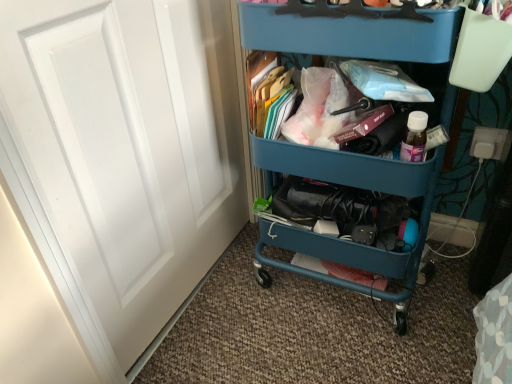
This screenshot has height=384, width=512. I want to click on blue plastic cart at upper center, so point(426,87).

What is the approximate height of white matte door at left?

white matte door at left is 31.99 inches in height.

At what (x,y) coordinates should I click in order to perform the action: click on teal plastic cart at center. Please return your answer as a coordinate pair (x, y). The width and height of the screenshot is (512, 384). Looking at the image, I should click on (348, 185).

Consider the image. Is white matte door at left a part of teal plastic cart at center?

Actually, white matte door at left is outside teal plastic cart at center.

Is white matte door at left at the back of teal plastic cart at center?

teal plastic cart at center is not turned away from white matte door at left.

Does teal plastic cart at center lie behind white matte door at left?

Yes, teal plastic cart at center is further from the viewer.

Which is farther from the camera, (269,152) or (198,97)?

The point (198,97) is farther.

In the scene shown: Is blue plastic cart at upper center aimed at white matte door at left?

No, blue plastic cart at upper center is not aimed at white matte door at left.

Is blue plastic cart at upper center to the right of white matte door at left from the viewer's perspective?

Correct, you'll find blue plastic cart at upper center to the right of white matte door at left.

Considering the relative sizes of blue plastic cart at upper center and white matte door at left in the image provided, is blue plastic cart at upper center wider than white matte door at left?

Yes, blue plastic cart at upper center is wider than white matte door at left.

Is there a large distance between blue plastic cart at upper center and white matte door at left?

They are positioned close to each other.

What's the angular difference between teal plastic cart at center and blue plastic cart at upper center's facing directions?

They differ by 0.00026 degrees in their facing directions.

Find the location of a particular element. The width and height of the screenshot is (512, 384). furniture in front of the blue plastic cart at upper center is located at coordinates (348, 185).

Can you confirm if teal plastic cart at center is positioned to the right of blue plastic cart at upper center?

Yes, teal plastic cart at center is to the right of blue plastic cart at upper center.

Which object is more forward, teal plastic cart at center or blue plastic cart at upper center?

teal plastic cart at center is closer to the camera.

In the image, is white matte door at left positioned in front of or behind teal plastic cart at center?

Clearly, white matte door at left is in front of teal plastic cart at center.

Is teal plastic cart at center completely or partially inside white matte door at left?

No, teal plastic cart at center is not surrounded by white matte door at left.

Based on their positions, is white matte door at left located to the left or right of teal plastic cart at center?

Clearly, white matte door at left is on the left of teal plastic cart at center in the image.

Considering the relative sizes of white matte door at left and teal plastic cart at center in the image provided, is white matte door at left shorter than teal plastic cart at center?

Incorrect, the height of white matte door at left does not fall short of that of teal plastic cart at center.

Which is more to the right, white matte door at left or blue plastic cart at upper center?

From the viewer's perspective, blue plastic cart at upper center appears more on the right side.

Looking at this image, which of these two, white matte door at left or blue plastic cart at upper center, is thinner?

white matte door at left is thinner.

Measure the distance between white matte door at left and blue plastic cart at upper center.

They are 17.21 inches apart.

Consider the image. Considering the sizes of objects white matte door at left and blue plastic cart at upper center in the image provided, who is taller, white matte door at left or blue plastic cart at upper center?

white matte door at left.

Does blue plastic cart at upper center turn towards teal plastic cart at center?

Yes, blue plastic cart at upper center is turned towards teal plastic cart at center.

From the image's perspective, is blue plastic cart at upper center positioned above or below teal plastic cart at center?

blue plastic cart at upper center is above teal plastic cart at center.

Is blue plastic cart at upper center spatially inside teal plastic cart at center, or outside of it?

blue plastic cart at upper center fits inside teal plastic cart at center.

Considering their positions, is blue plastic cart at upper center located in front of or behind teal plastic cart at center?

Visually, blue plastic cart at upper center is located behind teal plastic cart at center.

Image resolution: width=512 pixels, height=384 pixels. I want to click on furniture on the right of white matte door at left, so click(x=348, y=185).

The width and height of the screenshot is (512, 384). I want to click on cabinet located above the white matte door at left (from the image's perspective), so [426, 87].

Which object lies further to the anchor point blue plastic cart at upper center, white matte door at left or teal plastic cart at center?

white matte door at left lies further to blue plastic cart at upper center than the other object.

In the scene shown: When comparing their distances from white matte door at left, does teal plastic cart at center or blue plastic cart at upper center seem further?

blue plastic cart at upper center lies further to white matte door at left than the other object.

Looking at the image, which one is located further to blue plastic cart at upper center, teal plastic cart at center or white matte door at left?

Among the two, white matte door at left is located further to blue plastic cart at upper center.

Looking at the image, which one is located closer to teal plastic cart at center, white matte door at left or blue plastic cart at upper center?

blue plastic cart at upper center is positioned closer to the anchor teal plastic cart at center.

Considering their positions, is blue plastic cart at upper center positioned further to white matte door at left than teal plastic cart at center?

Based on the image, blue plastic cart at upper center appears to be further to white matte door at left.

From the image, which object appears to be nearer to teal plastic cart at center, blue plastic cart at upper center or white matte door at left?

Based on the image, blue plastic cart at upper center appears to be nearer to teal plastic cart at center.

Image resolution: width=512 pixels, height=384 pixels. In order to click on cabinet located between white matte door at left and teal plastic cart at center in the left-right direction in this screenshot , I will do `click(426, 87)`.